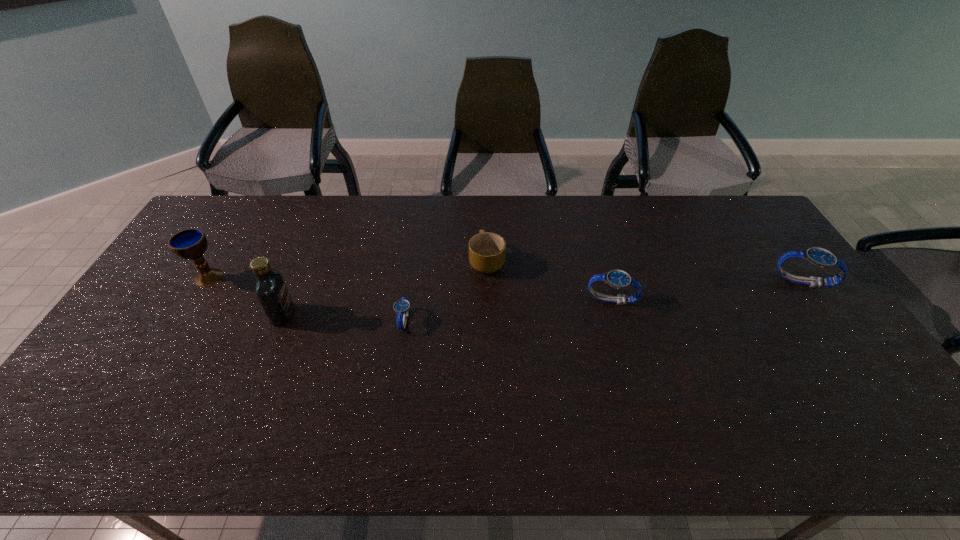
Find the location of a particular element. Image resolution: width=960 pixels, height=540 pixels. the third object from left to right is located at coordinates (401, 307).

Find the location of a particular element. This screenshot has width=960, height=540. the leftmost watch is located at coordinates [401, 307].

I want to click on the second watch from right to left, so click(x=618, y=279).

At what (x,y) coordinates should I click in order to perform the action: click on the second tallest watch. Please return your answer as a coordinate pair (x, y). This screenshot has width=960, height=540. Looking at the image, I should click on (618, 279).

What are the coordinates of `the rightmost watch` in the screenshot? It's located at (820, 257).

Find the location of a particular element. Image resolution: width=960 pixels, height=540 pixels. the fourth object from left to right is located at coordinates (487, 251).

Where is `the leftmost object`? This screenshot has width=960, height=540. the leftmost object is located at coordinates (191, 243).

Where is `the second tallest object`? The width and height of the screenshot is (960, 540). the second tallest object is located at coordinates (191, 243).

Locate an element on the screen. The width and height of the screenshot is (960, 540). the fifth object from right to left is located at coordinates (270, 289).

The width and height of the screenshot is (960, 540). I want to click on the tallest object, so click(270, 289).